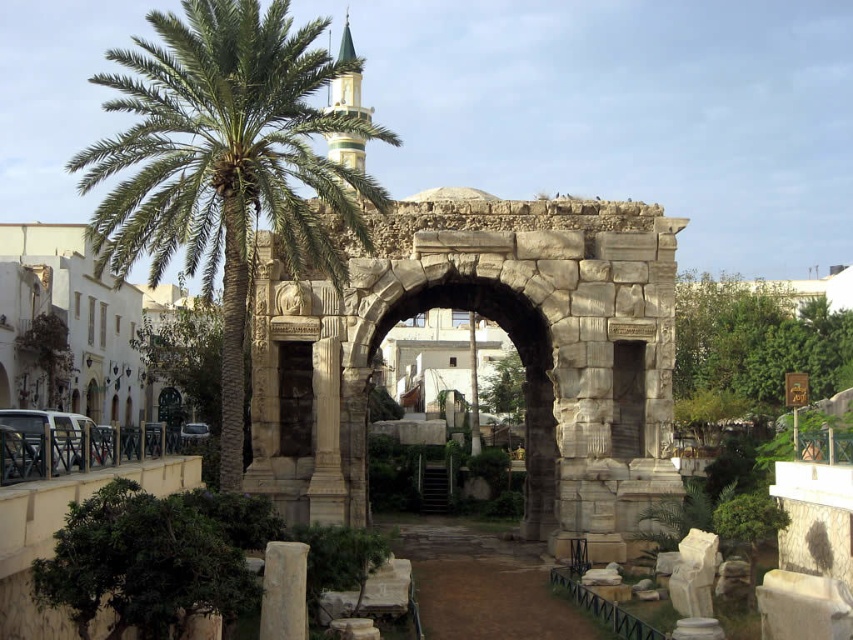
Question: Considering the real-world distances, which object is closest to the light beige stone column at lower center?

Choices:
 (A) dark stone arch at center
 (B) gray stone arch at center
 (C) stone archway at center
 (D) green leafy palm at center

Answer: (A)

Question: Which point is farther to the camera?

Choices:
 (A) (190, 28)
 (B) (302, 371)
 (C) (299, 584)

Answer: (B)

Question: Can you confirm if stone archway at center is smaller than gray stone arch at center?

Choices:
 (A) no
 (B) yes

Answer: (A)

Question: Does green leafy palm at center appear under gray stone arch at center?

Choices:
 (A) no
 (B) yes

Answer: (A)

Question: Does light beige stone column at lower center appear over dark stone arch at center?

Choices:
 (A) yes
 (B) no

Answer: (B)

Question: Considering the real-world distances, which object is closest to the stone archway at center?

Choices:
 (A) dark stone arch at center
 (B) gray stone arch at center
 (C) light beige stone column at lower center
 (D) green leafy palm at center

Answer: (A)